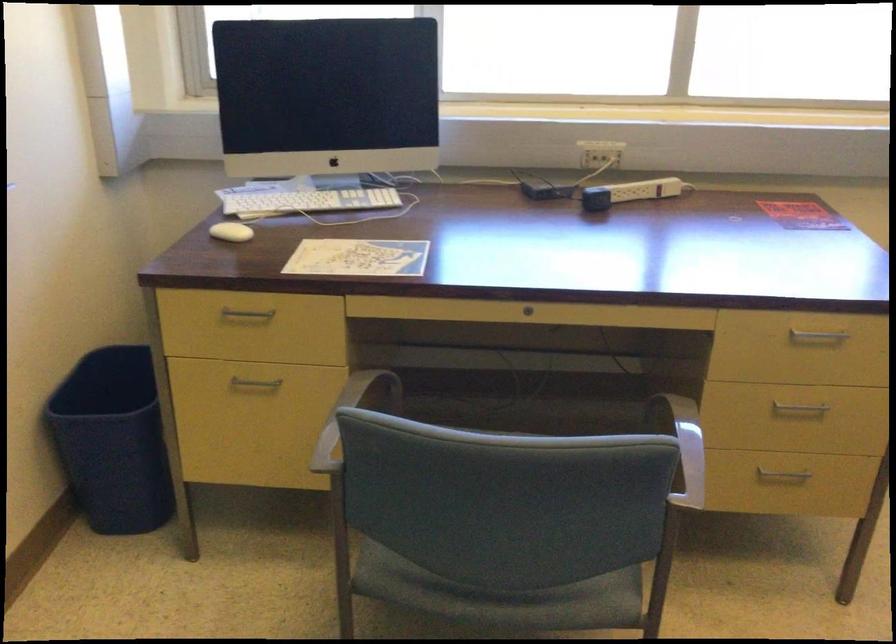
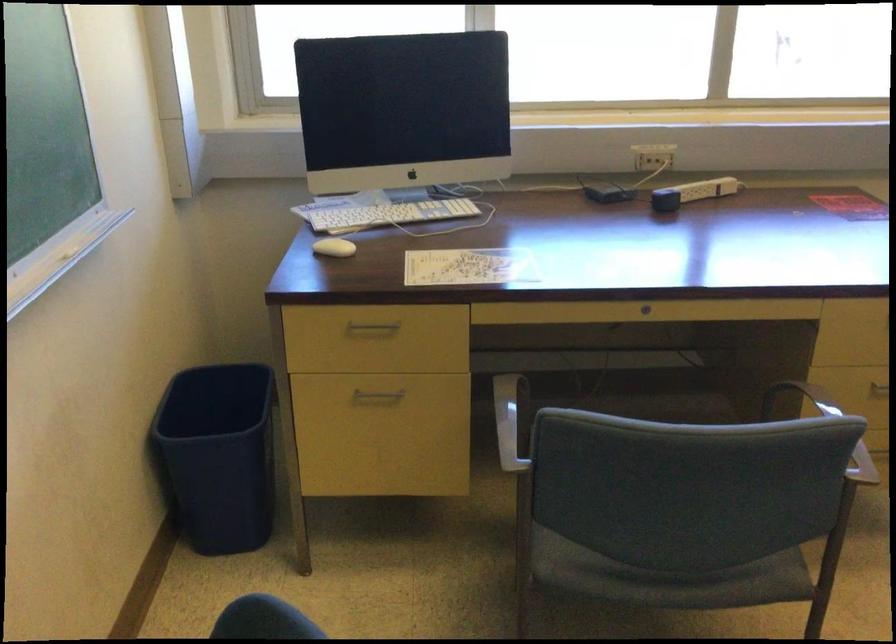
In the second image, find the point that corresponds to pixel 311 204 in the first image.

(389, 214)